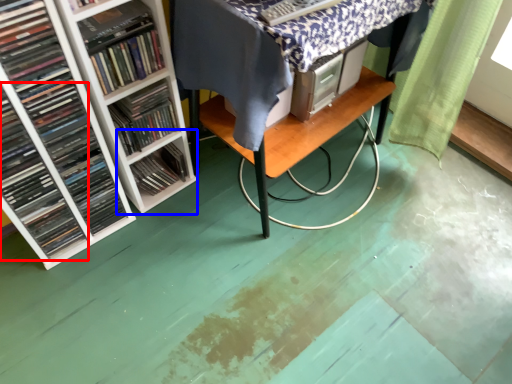
Question: Which object is closer to the camera taking this photo, book (highlighted by a red box) or shelf (highlighted by a blue box)?

Choices:
 (A) book
 (B) shelf

Answer: (A)